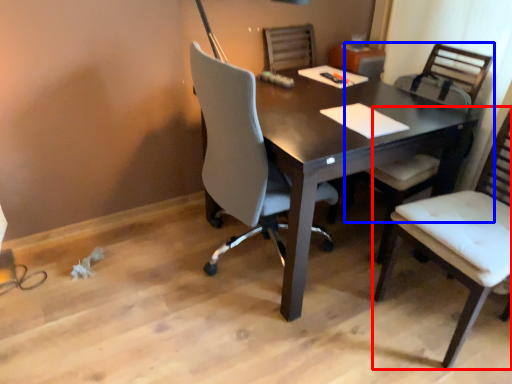
Question: Among these objects, which one is farthest to the camera, chair (highlighted by a red box) or chair (highlighted by a blue box)?

Choices:
 (A) chair
 (B) chair

Answer: (B)